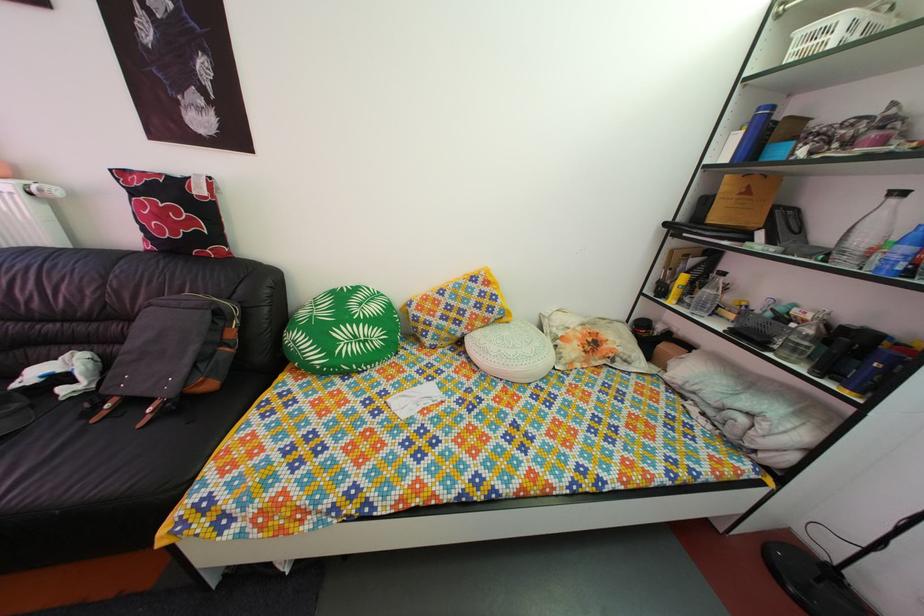
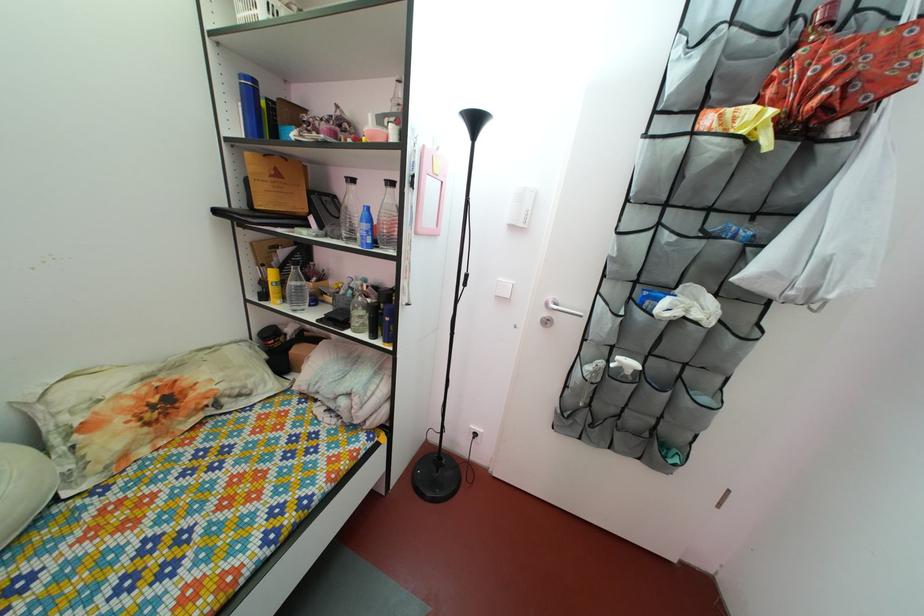
Where in the second image is the point corresponding to point 701,270 from the first image?

(292, 262)